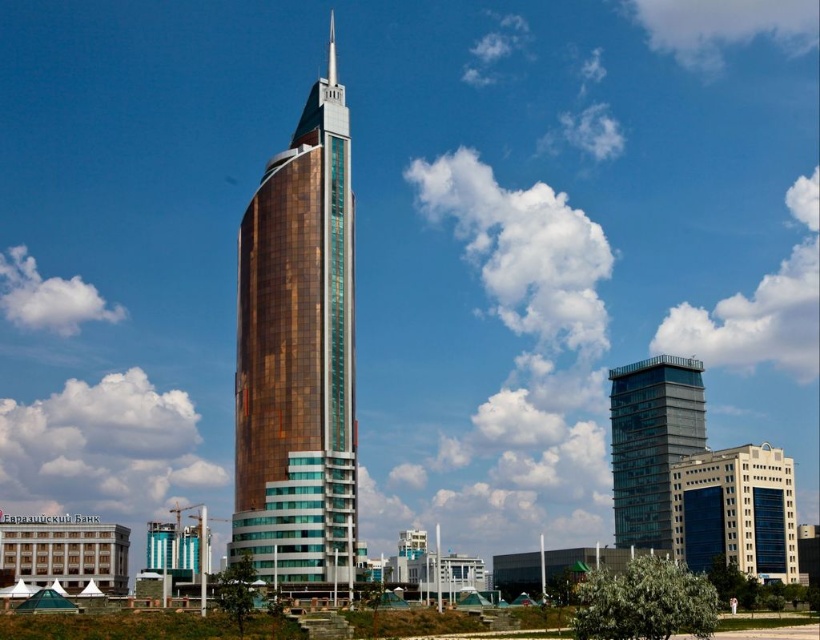
Between gold reflective glass tower at center and transparent glass building at center, which one has more height?

gold reflective glass tower at center is taller.

Is point (283, 220) farther from camera compared to point (629, 476)?

No.

Find the location of `gold reflective glass tower at center`. gold reflective glass tower at center is located at coordinates (298, 355).

Find the location of a particular element. This screenshot has height=640, width=820. gold reflective glass tower at center is located at coordinates (298, 355).

Does white glass building at lower right appear on the right side of transparent glass building at center?

Correct, you'll find white glass building at lower right to the right of transparent glass building at center.

Between white glass building at lower right and transparent glass building at center, which one has less height?

Standing shorter between the two is white glass building at lower right.

The height and width of the screenshot is (640, 820). Describe the element at coordinates (736, 512) in the screenshot. I see `white glass building at lower right` at that location.

Where is `white glass building at lower right`? The height and width of the screenshot is (640, 820). white glass building at lower right is located at coordinates (736, 512).

Which is more to the left, gold reflective glass tower at center or white glass building at lower right?

gold reflective glass tower at center is more to the left.

How far apart are gold reflective glass tower at center and white glass building at lower right?

gold reflective glass tower at center is 157.38 feet away from white glass building at lower right.

I want to click on gold reflective glass tower at center, so click(298, 355).